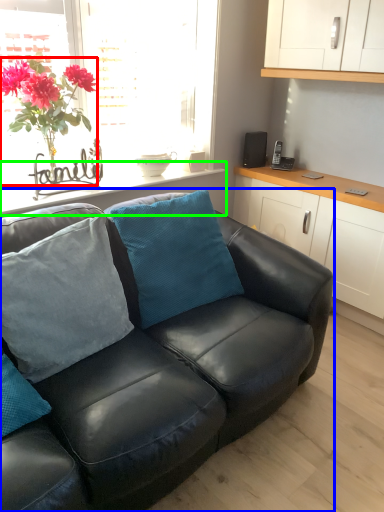
Question: Based on their relative distances, which object is farther from houseplant (highlighted by a red box)? Choose from studio couch (highlighted by a blue box) and window sill (highlighted by a green box).

Choices:
 (A) studio couch
 (B) window sill

Answer: (A)